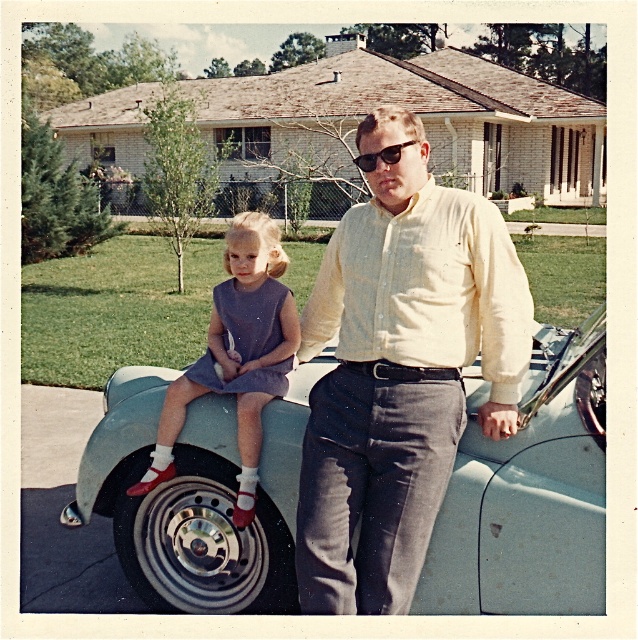
Question: In this image, where is light blue car at center located relative to metallic silver rim at lower left?

Choices:
 (A) below
 (B) above

Answer: (B)

Question: Which point is closer to the camera?

Choices:
 (A) (158, 563)
 (B) (364, 234)
 (C) (285, 378)

Answer: (B)

Question: Based on their relative distances, which object is farther from the light blue car at center?

Choices:
 (A) light yellow button-down shirt at center
 (B) matte purple dress at center
 (C) metallic silver rim at lower left

Answer: (A)

Question: Which point is closer to the camera?

Choices:
 (A) (360, 150)
 (B) (242, 358)
 (C) (256, 563)

Answer: (A)

Question: Can you confirm if light blue car at center is wider than matte purple dress at center?

Choices:
 (A) yes
 (B) no

Answer: (A)

Question: Is light yellow button-down shirt at center positioned before matte purple dress at center?

Choices:
 (A) yes
 (B) no

Answer: (A)